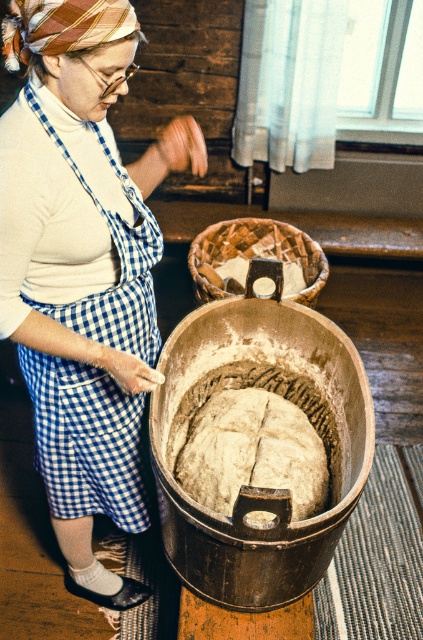
Is white turtleneck at center shorter than woven wood basket at center?

In fact, white turtleneck at center may be taller than woven wood basket at center.

Does white turtleneck at center appear on the right side of woven wood basket at center?

In fact, white turtleneck at center is to the left of woven wood basket at center.

Find the location of a particular element. white turtleneck at center is located at coordinates (82, 268).

Which is above, spongy dough at center or woven wood basket at center?

Positioned higher is woven wood basket at center.

Who is shorter, spongy dough at center or woven wood basket at center?

Standing shorter between the two is spongy dough at center.

Locate an element on the screen. This screenshot has width=423, height=640. spongy dough at center is located at coordinates (255, 436).

Image resolution: width=423 pixels, height=640 pixels. Identify the location of spongy dough at center. (255, 436).

Can you confirm if wooden bowl at center is positioned below woven wood basket at center?

Yes.

Who is more distant from viewer, (x=230, y=323) or (x=302, y=230)?

Point (x=302, y=230)

You are a GUI agent. You are given a task and a screenshot of the screen. Output one action in this format:
    pyautogui.click(x=<x>, y=<y>)
    Task: Click on the wooden bowl at center
    
    Given the screenshot: What is the action you would take?
    pyautogui.click(x=260, y=490)

Identify the location of wooden bowl at center. (260, 490).